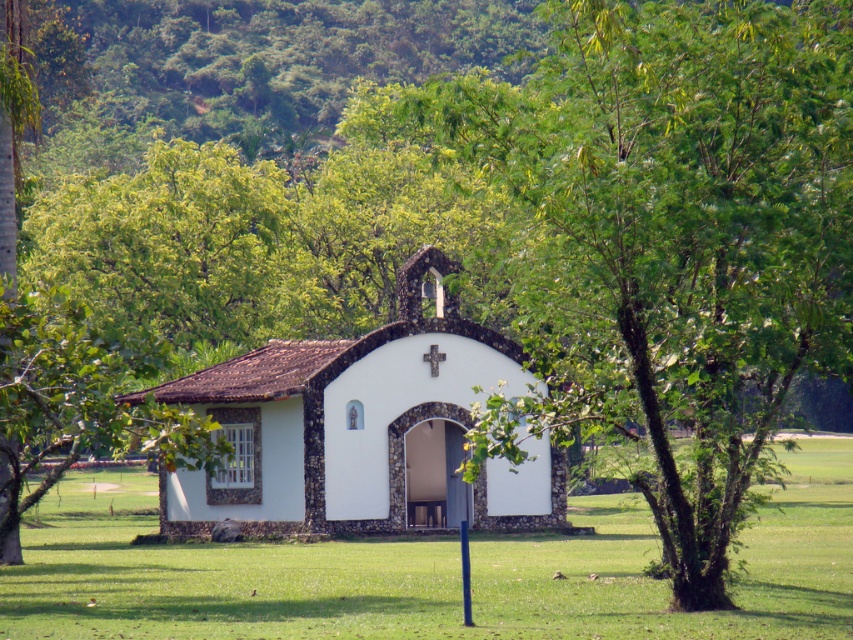
Question: From the image, what is the correct spatial relationship of green leafy tree at center in relation to white stucco church at center?

Choices:
 (A) right
 (B) left

Answer: (A)

Question: Considering the real-world distances, which object is farthest from the green grass at center?

Choices:
 (A) white stucco church at center
 (B) green leafy tree at center

Answer: (B)

Question: Estimate the real-world distances between objects in this image. Which object is closer to the green grass at center?

Choices:
 (A) green leafy tree at center
 (B) white stucco church at center

Answer: (B)

Question: Which object is closer to the camera taking this photo?

Choices:
 (A) green leafy tree at center
 (B) white stucco church at center

Answer: (A)

Question: Can you confirm if green leafy tree at center is positioned above white stucco church at center?

Choices:
 (A) yes
 (B) no

Answer: (A)

Question: Is green leafy tree at center to the left of white stucco church at center from the viewer's perspective?

Choices:
 (A) yes
 (B) no

Answer: (B)